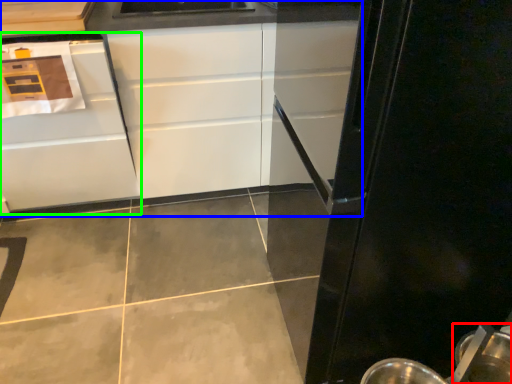
Question: Which object is positioned closest to appliance (highlighted by a red box)? Select from cabinetry (highlighted by a blue box) and cabinetry (highlighted by a green box).

Choices:
 (A) cabinetry
 (B) cabinetry

Answer: (A)